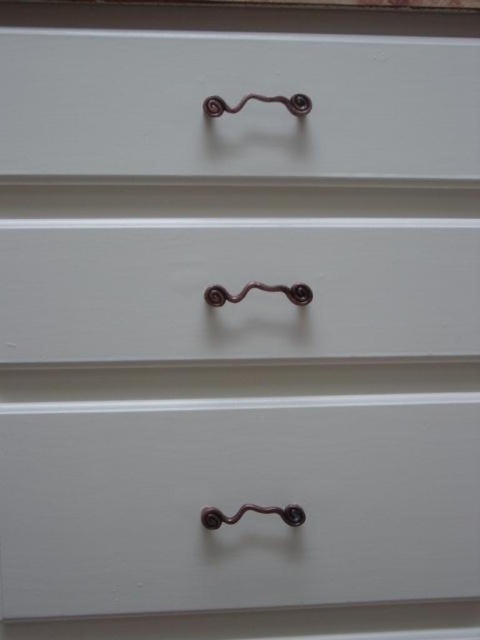
Question: Which of these objects is positioned closest to the matte brown handle at upper center?

Choices:
 (A) white matte drawer at lower center
 (B) matte white drawer at center

Answer: (B)

Question: Based on their relative distances, which object is nearer to the matte brown handle at upper center?

Choices:
 (A) matte white drawer at center
 (B) white matte drawer at lower center

Answer: (A)

Question: In this image, where is matte brown handle at upper center located relative to matte white drawer at center?

Choices:
 (A) above
 (B) below

Answer: (A)

Question: Can you confirm if white matte drawer at lower center is smaller than matte brown handle at upper center?

Choices:
 (A) no
 (B) yes

Answer: (A)

Question: Among these points, which one is nearest to the camera?

Choices:
 (A) (82, 445)
 (B) (245, 250)

Answer: (B)

Question: Does matte brown handle at upper center have a larger size compared to matte white drawer at center?

Choices:
 (A) no
 (B) yes

Answer: (B)